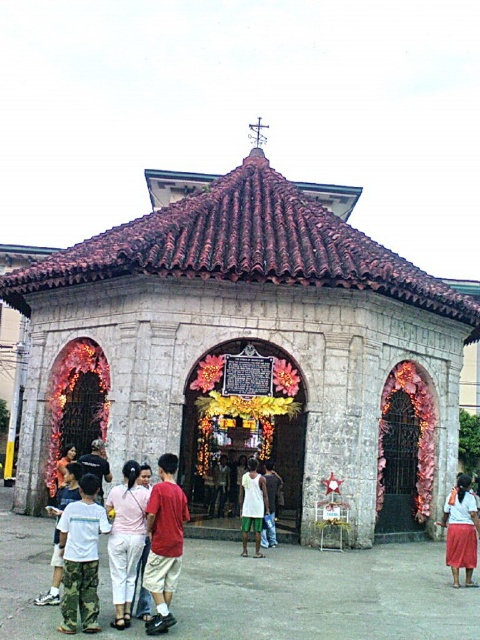
Which is more to the right, stone temple at center or white matte shirt at center?

From the viewer's perspective, stone temple at center appears more on the right side.

Measure the distance from stone temple at center to white matte shirt at center.

stone temple at center and white matte shirt at center are 9.17 meters apart from each other.

The width and height of the screenshot is (480, 640). What do you see at coordinates (249, 349) in the screenshot?
I see `stone temple at center` at bounding box center [249, 349].

I want to click on stone temple at center, so click(x=249, y=349).

Is the position of pink fabric pants at center less distant than that of white matte shirt at center?

Yes, it is.

The height and width of the screenshot is (640, 480). What do you see at coordinates (126, 540) in the screenshot? I see `pink fabric pants at center` at bounding box center [126, 540].

Where is `pink fabric pants at center`? Image resolution: width=480 pixels, height=640 pixels. pink fabric pants at center is located at coordinates (126, 540).

Does red cotton shirt at center have a smaller size compared to white matte shirt at center?

Yes.

Is point (168, 580) more distant than point (264, 512)?

No, (168, 580) is in front of (264, 512).

Measure the distance between red cotton shirt at center and camera.

red cotton shirt at center and camera are 15.83 meters apart from each other.

The width and height of the screenshot is (480, 640). I want to click on red cotton shirt at center, so click(x=164, y=541).